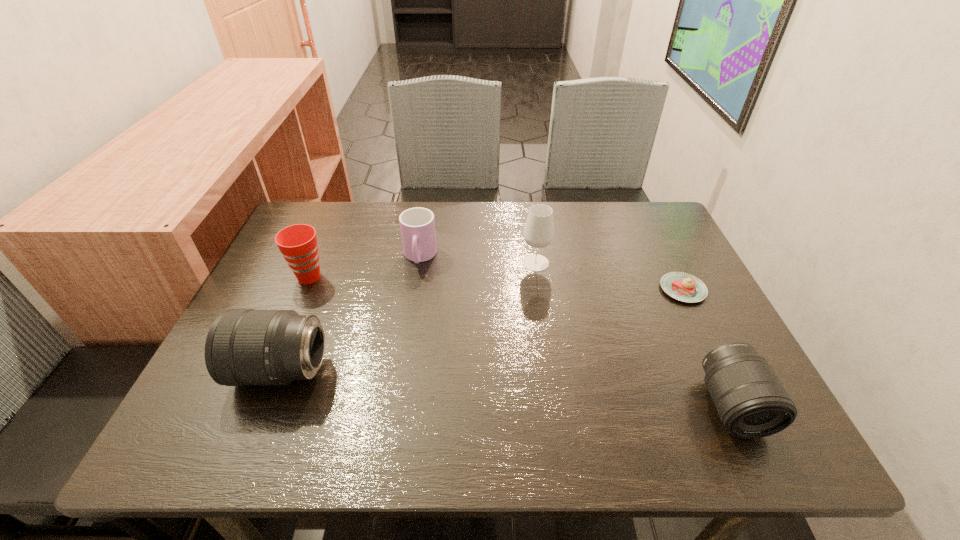
Find the location of `the left telephoto lens`. the left telephoto lens is located at coordinates (243, 347).

In order to click on the right telephoto lens in this screenshot , I will do `click(751, 402)`.

Identify the location of the right cup. pyautogui.click(x=417, y=225).

What are the coordinates of `the third object from right to left` in the screenshot? It's located at (539, 230).

The width and height of the screenshot is (960, 540). What are the coordinates of `the left cup` in the screenshot? It's located at (298, 243).

The width and height of the screenshot is (960, 540). Find the location of `the shortest object`. the shortest object is located at coordinates (684, 287).

I want to click on vacant space located 0.260m with the handle on the side of the right cup, so click(x=404, y=353).

Where is `vacant space located 0.070m on the front of the glass`? This screenshot has height=540, width=960. vacant space located 0.070m on the front of the glass is located at coordinates (540, 291).

Identify the location of free space located on the left of the left cup. tap(272, 277).

Where is `blank area located 0.060m on the front of the pastry`? blank area located 0.060m on the front of the pastry is located at coordinates (700, 324).